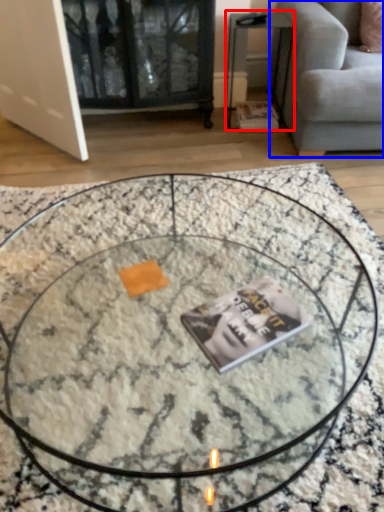
Question: Which object is closer to the camera taking this photo, side table (highlighted by a red box) or studio couch (highlighted by a blue box)?

Choices:
 (A) side table
 (B) studio couch

Answer: (B)